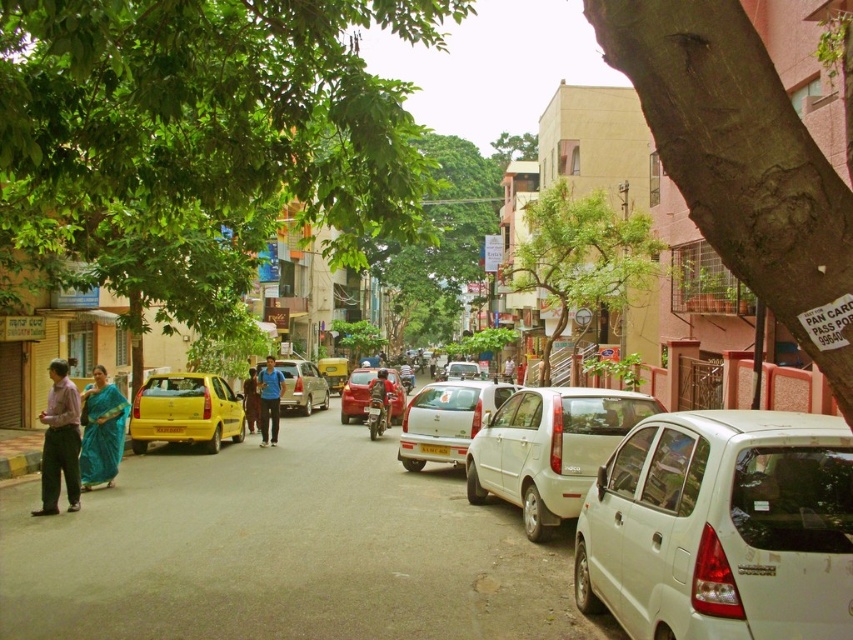
Does green leafy tree at upper left appear over blue silk saree at lower left?

Correct, green leafy tree at upper left is located above blue silk saree at lower left.

Is green leafy tree at upper left closer to camera compared to blue silk saree at lower left?

Yes.

Where is `green leafy tree at upper left`? green leafy tree at upper left is located at coordinates (204, 120).

Does matte pink shirt at left appear on the right side of blue fabric person at center?

Yes, matte pink shirt at left is to the right of blue fabric person at center.

Where is `matte pink shirt at left`? matte pink shirt at left is located at coordinates (59, 442).

Is point (44, 410) closer to viewer compared to point (253, 371)?

Yes.

This screenshot has width=853, height=640. Find the location of `matte pink shirt at left`. matte pink shirt at left is located at coordinates (59, 442).

Which is in front, point (699, 230) or point (132, 433)?

Point (699, 230)

Does brown rough bark at upper right have a lesser height compared to shiny yellow hatchback at center?

Yes, brown rough bark at upper right is shorter than shiny yellow hatchback at center.

Does point (801, 346) lie in front of point (206, 436)?

Yes, point (801, 346) is closer to viewer.

Locate an element on the screen. brown rough bark at upper right is located at coordinates (741, 163).